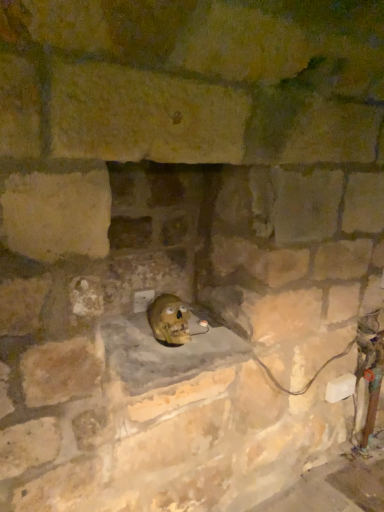
The height and width of the screenshot is (512, 384). Identify the location of free point behind yellow matte skull at center. (196, 321).